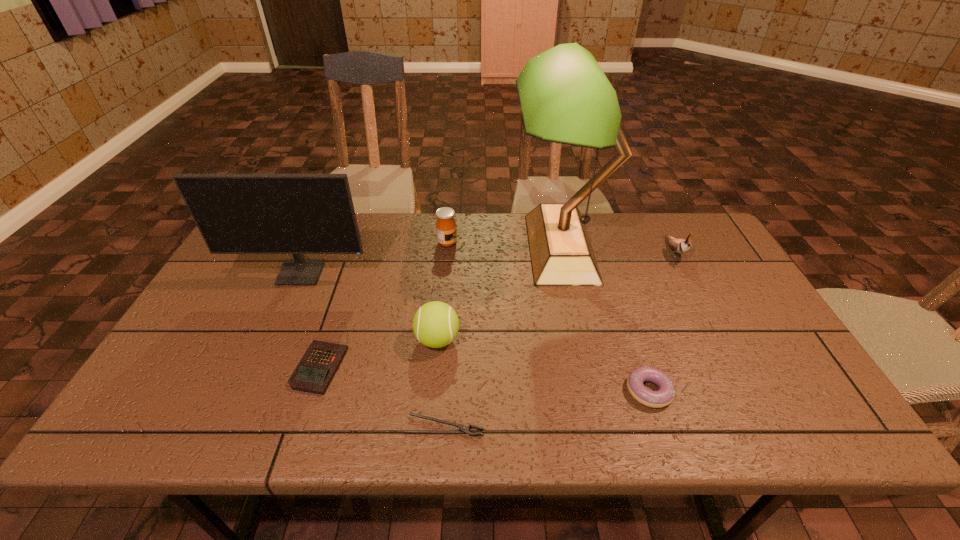
Image resolution: width=960 pixels, height=540 pixels. Identify the location of free space located 0.110m on the metallic stand of the tallest object. (476, 248).

The image size is (960, 540). I want to click on vacant space located 0.080m on the metallic stand of the tallest object, so click(486, 248).

The image size is (960, 540). In order to click on vacant space located on the front-facing side of the computer monitor in this screenshot , I will do `click(281, 317)`.

This screenshot has width=960, height=540. In order to click on vacant position located on the front-facing side of the honey in this screenshot , I will do `click(492, 243)`.

You are a GUI agent. You are given a task and a screenshot of the screen. Output one action in this format:
    pyautogui.click(x=<x>, y=<y>)
    Task: Click on the vacant region located 0.150m at the face of the bird
    The height and width of the screenshot is (540, 960).
    Given the screenshot: What is the action you would take?
    pyautogui.click(x=702, y=305)

Image resolution: width=960 pixels, height=540 pixels. I want to click on free location located 0.280m on the right of the tennis ball, so click(x=570, y=340).

Find the location of `free space located 0.160m on the left of the doughnut`. free space located 0.160m on the left of the doughnut is located at coordinates (556, 391).

Find the location of `vacant space situated on the back of the calculator`. vacant space situated on the back of the calculator is located at coordinates (351, 270).

I want to click on vacant space situated 0.150m on the back of the tongs, so click(449, 360).

Locate an element on the screen. The height and width of the screenshot is (540, 960). table lamp at the far edge is located at coordinates (565, 97).